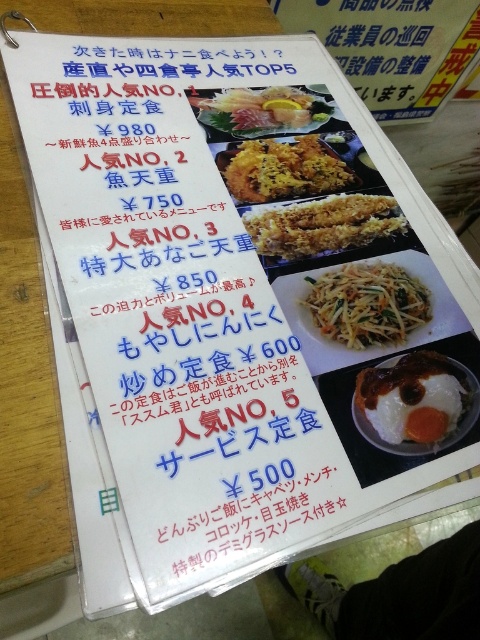
You are a customer looking at the menu card. The golden crispy fried at center and the shiny silver sashimi at upper center are both on the menu. Which dish is positioned higher on the menu card?

The shiny silver sashimi at upper center is positioned higher on the menu card than the golden crispy fried at center.

You are a customer looking at the menu card and want to order the white glossy fried egg at center and the golden crispy fried chicken at center. Since both items are listed at the center of the menu, which one appears closer to you on the menu card?

The white glossy fried egg at center is closer to the viewer than the golden crispy fried chicken at center, so it appears closer on the menu card.